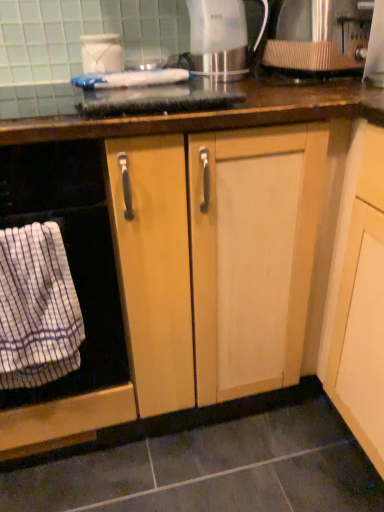
Describe the element at coordinates (37, 308) in the screenshot. The height and width of the screenshot is (512, 384). I see `white striped cloth at left` at that location.

What do you see at coordinates (221, 38) in the screenshot?
I see `metallic silver kettle at upper center, acting as the 2th kitchen appliance starting from the right` at bounding box center [221, 38].

What do you see at coordinates (102, 53) in the screenshot? The image size is (384, 512). I see `white glossy jar at upper center, the first kitchen appliance in the left-to-right sequence` at bounding box center [102, 53].

Find the location of a particular element. white striped towel at left is located at coordinates (77, 294).

At what (x,y) coordinates should I click in order to perform the action: click on metallic brushed coffee filter at upper right, the 3th kitchen appliance positioned from the left. Please return your answer as a coordinate pair (x, y). This screenshot has width=384, height=512. Looking at the image, I should click on (317, 37).

Is metallic silver kettle at upper center, which ranks as the 2th kitchen appliance in left-to-right order, far away from metallic brushed coffee filter at upper right, the 3th kitchen appliance positioned from the left?

No, metallic silver kettle at upper center, which ranks as the 2th kitchen appliance in left-to-right order, is not far away from metallic brushed coffee filter at upper right, the 3th kitchen appliance positioned from the left.

In terms of width, does metallic silver kettle at upper center, which ranks as the 2th kitchen appliance in left-to-right order, look wider or thinner when compared to metallic brushed coffee filter at upper right, which is the 1th kitchen appliance from right to left?

Clearly, metallic silver kettle at upper center, which ranks as the 2th kitchen appliance in left-to-right order, has less width compared to metallic brushed coffee filter at upper right, which is the 1th kitchen appliance from right to left.

From a real-world perspective, is metallic silver kettle at upper center, acting as the 2th kitchen appliance starting from the right, located higher than metallic brushed coffee filter at upper right, the 3th kitchen appliance positioned from the left?

Yes, from a real-world perspective, metallic silver kettle at upper center, acting as the 2th kitchen appliance starting from the right, is above metallic brushed coffee filter at upper right, the 3th kitchen appliance positioned from the left.

Is metallic silver kettle at upper center, which ranks as the 2th kitchen appliance in left-to-right order, located outside metallic brushed coffee filter at upper right, the 3th kitchen appliance positioned from the left?

Yes.

Does metallic brushed coffee filter at upper right, the 3th kitchen appliance positioned from the left, touch white striped towel at left?

No, metallic brushed coffee filter at upper right, the 3th kitchen appliance positioned from the left, is not making contact with white striped towel at left.

Where is `home appliance below the metallic brushed coffee filter at upper right, the 3th kitchen appliance positioned from the left (from a real-world perspective)`? The height and width of the screenshot is (512, 384). home appliance below the metallic brushed coffee filter at upper right, the 3th kitchen appliance positioned from the left (from a real-world perspective) is located at coordinates (77, 294).

Can you confirm if metallic brushed coffee filter at upper right, the 3th kitchen appliance positioned from the left, is wider than white striped towel at left?

No, metallic brushed coffee filter at upper right, the 3th kitchen appliance positioned from the left, is not wider than white striped towel at left.

Is metallic brushed coffee filter at upper right, the 3th kitchen appliance positioned from the left, completely or partially outside of white striped towel at left?

Yes, metallic brushed coffee filter at upper right, the 3th kitchen appliance positioned from the left, is located beyond the bounds of white striped towel at left.

Could you tell me if white glossy jar at upper center, the first kitchen appliance in the left-to-right sequence, is turned towards white striped cloth at left?

No, white glossy jar at upper center, the first kitchen appliance in the left-to-right sequence, is not turned towards white striped cloth at left.

Is point (110, 55) farther from viewer compared to point (55, 332)?

Yes, it is behind point (55, 332).

Considering the positions of objects white glossy jar at upper center, the first kitchen appliance in the left-to-right sequence, and white striped cloth at left in the image provided, who is in front, white glossy jar at upper center, the first kitchen appliance in the left-to-right sequence, or white striped cloth at left?

Positioned in front is white striped cloth at left.

Is white glossy jar at upper center, the first kitchen appliance in the left-to-right sequence, inside or outside of white striped cloth at left?

white glossy jar at upper center, the first kitchen appliance in the left-to-right sequence, is spatially situated outside white striped cloth at left.

Does point (95, 42) come farther from viewer compared to point (217, 16)?

No.

Is white glossy jar at upper center, the 3th kitchen appliance viewed from the right, positioned beyond the bounds of metallic silver kettle at upper center, which ranks as the 2th kitchen appliance in left-to-right order?

That's correct, white glossy jar at upper center, the 3th kitchen appliance viewed from the right, is outside of metallic silver kettle at upper center, which ranks as the 2th kitchen appliance in left-to-right order.

Which object is further away from the camera taking this photo, white glossy jar at upper center, the 3th kitchen appliance viewed from the right, or metallic silver kettle at upper center, acting as the 2th kitchen appliance starting from the right?

Positioned behind is white glossy jar at upper center, the 3th kitchen appliance viewed from the right.

From a real-world perspective, which is physically above, white glossy jar at upper center, the 3th kitchen appliance viewed from the right, or metallic silver kettle at upper center, which ranks as the 2th kitchen appliance in left-to-right order?

metallic silver kettle at upper center, which ranks as the 2th kitchen appliance in left-to-right order, from a real-world perspective.

From the image's perspective, is white striped cloth at left above or below white striped towel at left?

white striped cloth at left is below white striped towel at left.

The image size is (384, 512). In order to click on bath towel on the right of white striped towel at left in this screenshot , I will do `click(37, 308)`.

Is white striped cloth at left smaller than white striped towel at left?

Correct, white striped cloth at left occupies less space than white striped towel at left.

Could you tell me if white striped cloth at left is facing white striped towel at left?

Yes, white striped cloth at left is aimed at white striped towel at left.

Is point (317, 55) less distant than point (195, 15)?

Yes.

Can you confirm if metallic brushed coffee filter at upper right, which is the 1th kitchen appliance from right to left, is shorter than metallic silver kettle at upper center, acting as the 2th kitchen appliance starting from the right?

Indeed, metallic brushed coffee filter at upper right, which is the 1th kitchen appliance from right to left, has a lesser height compared to metallic silver kettle at upper center, acting as the 2th kitchen appliance starting from the right.

From a real-world perspective, is metallic brushed coffee filter at upper right, the 3th kitchen appliance positioned from the left, above or below metallic silver kettle at upper center, which ranks as the 2th kitchen appliance in left-to-right order?

metallic brushed coffee filter at upper right, the 3th kitchen appliance positioned from the left, is below metallic silver kettle at upper center, which ranks as the 2th kitchen appliance in left-to-right order.

From a real-world perspective, is metallic brushed coffee filter at upper right, which is the 1th kitchen appliance from right to left, below white striped cloth at left?

No, from a real-world perspective, metallic brushed coffee filter at upper right, which is the 1th kitchen appliance from right to left, is not below white striped cloth at left.

Who is shorter, metallic brushed coffee filter at upper right, the 3th kitchen appliance positioned from the left, or white striped cloth at left?

metallic brushed coffee filter at upper right, the 3th kitchen appliance positioned from the left.

Considering the positions of objects metallic brushed coffee filter at upper right, the 3th kitchen appliance positioned from the left, and white striped cloth at left in the image provided, who is more to the right, metallic brushed coffee filter at upper right, the 3th kitchen appliance positioned from the left, or white striped cloth at left?

metallic brushed coffee filter at upper right, the 3th kitchen appliance positioned from the left, is more to the right.

In order to click on kitchen appliance that is the 1st object located behind the white striped cloth at left in this screenshot , I will do `click(317, 37)`.

Where is `kitchen appliance in front of the metallic silver kettle at upper center, which ranks as the 2th kitchen appliance in left-to-right order`? This screenshot has width=384, height=512. kitchen appliance in front of the metallic silver kettle at upper center, which ranks as the 2th kitchen appliance in left-to-right order is located at coordinates (317, 37).

What are the coordinates of `home appliance beneath the metallic brushed coffee filter at upper right, which is the 1th kitchen appliance from right to left (from a real-world perspective)` in the screenshot? It's located at (77, 294).

Considering their positions, is white striped cloth at left positioned further to white glossy jar at upper center, the first kitchen appliance in the left-to-right sequence, than metallic brushed coffee filter at upper right, the 3th kitchen appliance positioned from the left?

Among the two, white striped cloth at left is located further to white glossy jar at upper center, the first kitchen appliance in the left-to-right sequence.

Considering their positions, is metallic silver kettle at upper center, acting as the 2th kitchen appliance starting from the right, positioned closer to white glossy jar at upper center, the 3th kitchen appliance viewed from the right, than metallic brushed coffee filter at upper right, which is the 1th kitchen appliance from right to left?

metallic silver kettle at upper center, acting as the 2th kitchen appliance starting from the right, is closer to white glossy jar at upper center, the 3th kitchen appliance viewed from the right.

When comparing their distances from metallic brushed coffee filter at upper right, which is the 1th kitchen appliance from right to left, does white striped cloth at left or white striped towel at left seem closer?

white striped towel at left is closer to metallic brushed coffee filter at upper right, which is the 1th kitchen appliance from right to left.

Looking at the image, which one is located closer to white glossy jar at upper center, the 3th kitchen appliance viewed from the right, metallic brushed coffee filter at upper right, the 3th kitchen appliance positioned from the left, or white striped cloth at left?

metallic brushed coffee filter at upper right, the 3th kitchen appliance positioned from the left, is positioned closer to the anchor white glossy jar at upper center, the 3th kitchen appliance viewed from the right.

Looking at the image, which one is located further to white striped towel at left, white glossy jar at upper center, the 3th kitchen appliance viewed from the right, or white striped cloth at left?

white glossy jar at upper center, the 3th kitchen appliance viewed from the right.

From the image, which object appears to be nearer to metallic brushed coffee filter at upper right, the 3th kitchen appliance positioned from the left, white glossy jar at upper center, the first kitchen appliance in the left-to-right sequence, or metallic silver kettle at upper center, which ranks as the 2th kitchen appliance in left-to-right order?

metallic silver kettle at upper center, which ranks as the 2th kitchen appliance in left-to-right order.

Looking at the image, which one is located further to metallic silver kettle at upper center, acting as the 2th kitchen appliance starting from the right, white striped towel at left or white glossy jar at upper center, the first kitchen appliance in the left-to-right sequence?

The object further to metallic silver kettle at upper center, acting as the 2th kitchen appliance starting from the right, is white striped towel at left.

Considering their positions, is white glossy jar at upper center, the 3th kitchen appliance viewed from the right, positioned further to metallic silver kettle at upper center, acting as the 2th kitchen appliance starting from the right, than white striped cloth at left?

white striped cloth at left is positioned further to the anchor metallic silver kettle at upper center, acting as the 2th kitchen appliance starting from the right.

The height and width of the screenshot is (512, 384). I want to click on kitchen appliance between metallic brushed coffee filter at upper right, the 3th kitchen appliance positioned from the left, and white striped cloth at left, in the vertical direction, so click(x=102, y=53).

In order to click on home appliance between white glossy jar at upper center, the first kitchen appliance in the left-to-right sequence, and white striped cloth at left in the up-down direction in this screenshot , I will do `click(77, 294)`.

The height and width of the screenshot is (512, 384). Find the location of `kitchen appliance between white glossy jar at upper center, the first kitchen appliance in the left-to-right sequence, and metallic brushed coffee filter at upper right, the 3th kitchen appliance positioned from the left, from left to right`. kitchen appliance between white glossy jar at upper center, the first kitchen appliance in the left-to-right sequence, and metallic brushed coffee filter at upper right, the 3th kitchen appliance positioned from the left, from left to right is located at coordinates (221, 38).

Image resolution: width=384 pixels, height=512 pixels. I want to click on bath towel located between white striped towel at left and metallic brushed coffee filter at upper right, which is the 1th kitchen appliance from right to left, in the left-right direction, so click(x=37, y=308).